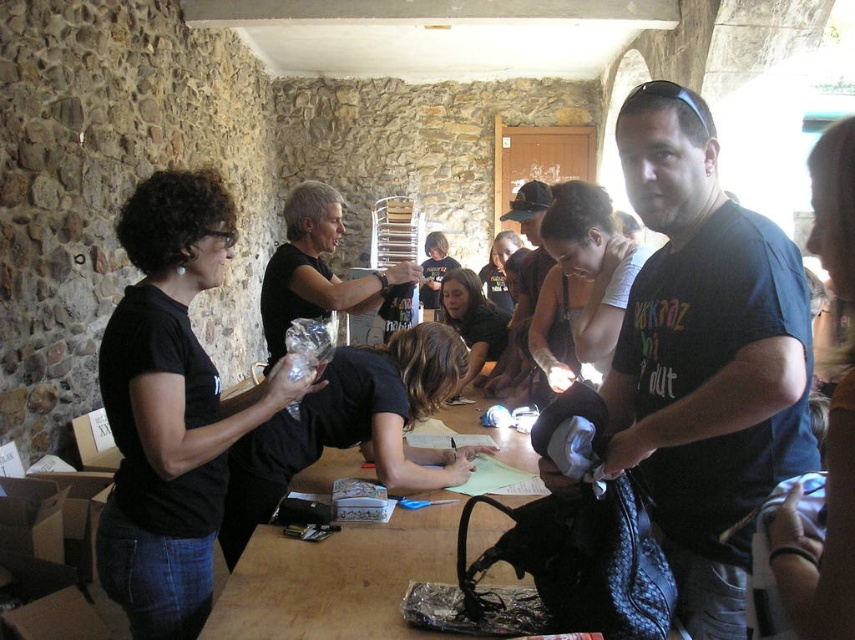
Question: Is black matte t-shirt at center positioned before wooden table at center?

Choices:
 (A) yes
 (B) no

Answer: (A)

Question: Where is black matte shirt at left located in relation to wooden table at center in the image?

Choices:
 (A) above
 (B) below

Answer: (A)

Question: Is wooden table at center bigger than black matte shirt at center?

Choices:
 (A) no
 (B) yes

Answer: (A)

Question: Which of the following is the closest to the observer?

Choices:
 (A) black matte t-shirt at center
 (B) black matte shirt at center

Answer: (A)

Question: Which of the following is the farthest from the observer?

Choices:
 (A) black matte shirt at left
 (B) black matte t-shirt at center
 (C) black matte shirt at center
 (D) wooden table at center

Answer: (C)

Question: Which point is farther to the camera?

Choices:
 (A) black matte shirt at left
 (B) wooden table at center
 (C) black matte t-shirt at center
 (D) black matte shirt at center

Answer: (D)